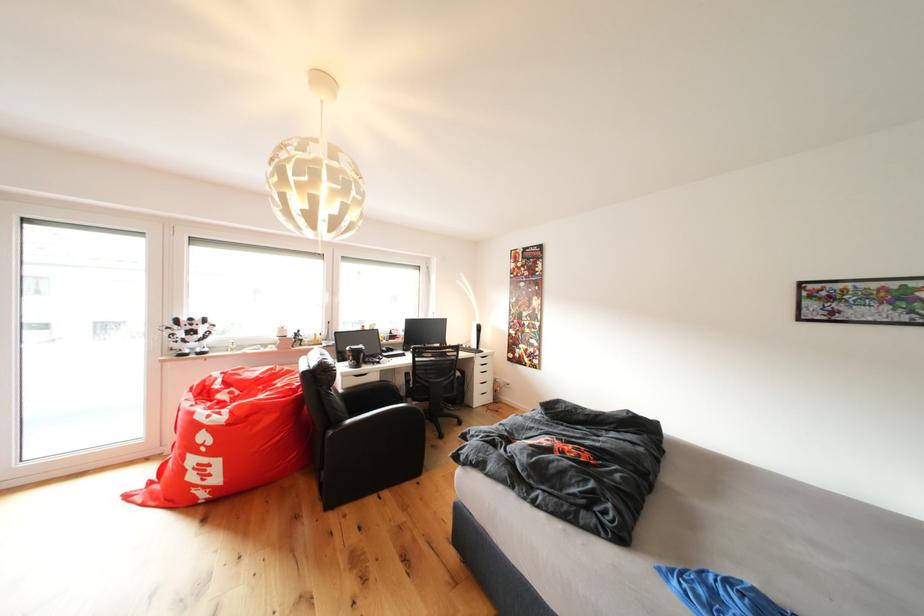
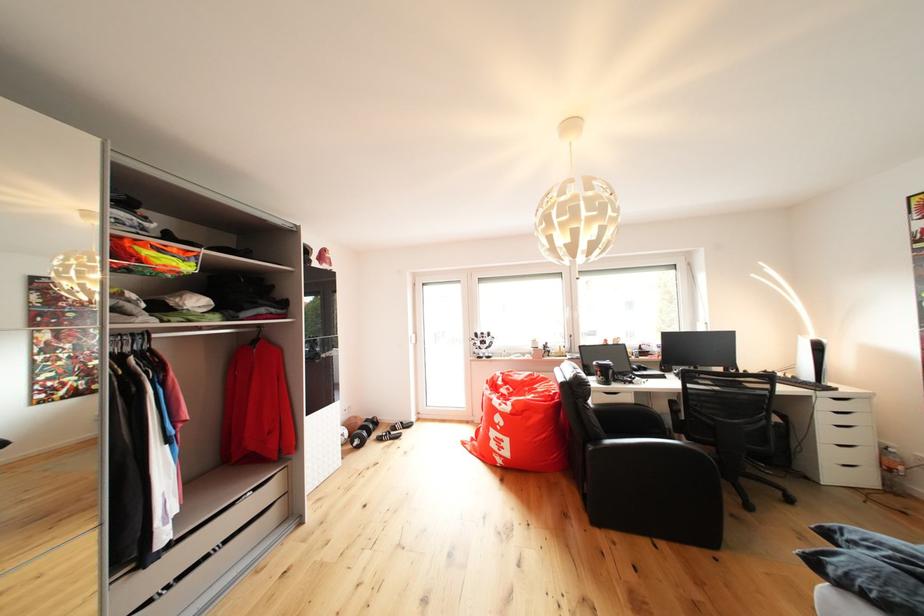
Where in the second image is the point corresponding to (x=494, y=357) from the first image?

(855, 395)